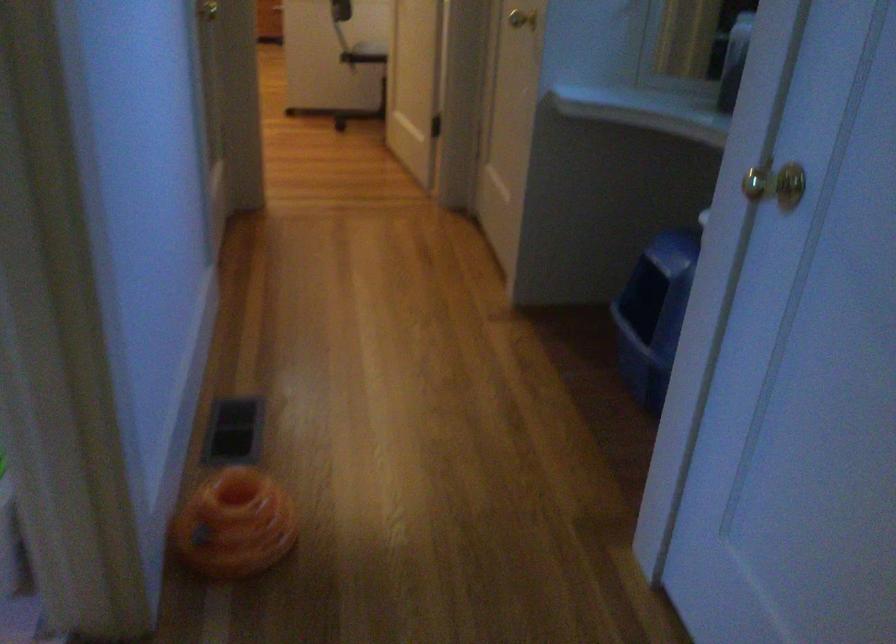
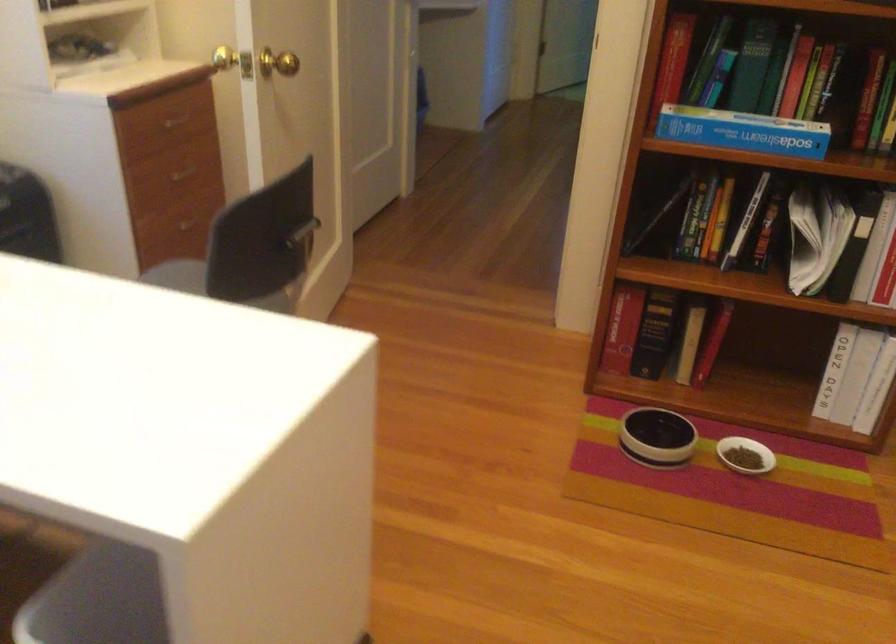
Question: I am providing you with two images of the same scene from different viewpoints. Which of the following objects are not visible in image2?

Choices:
 (A) orange cat toy
 (B) small white bowl
 (C) blender jar
 (D) black book

Answer: (A)